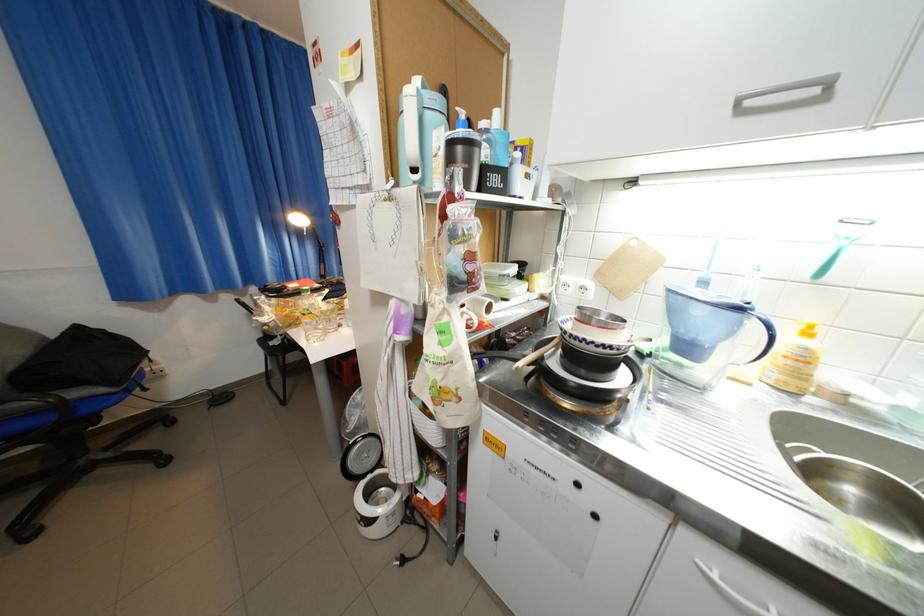
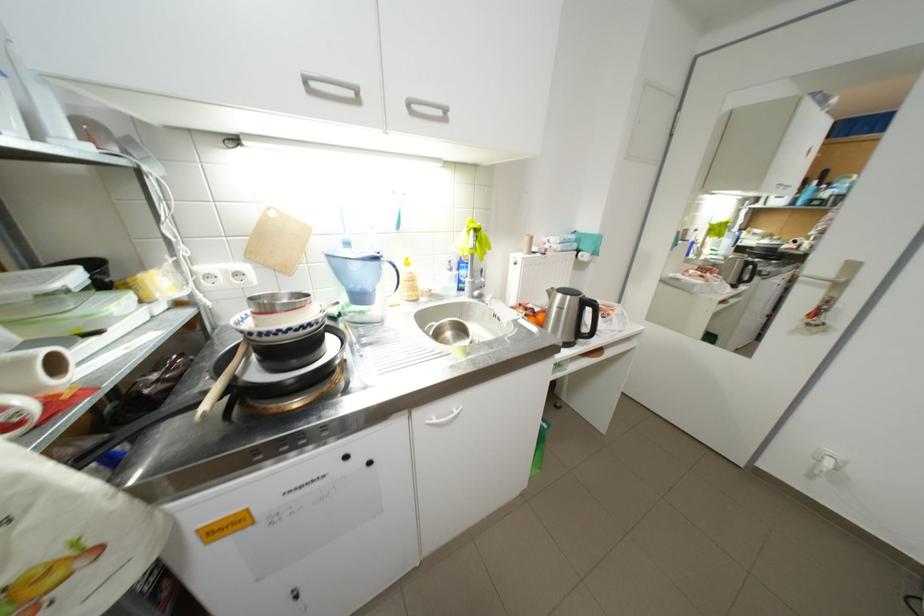
Where in the second image is the point corresponding to (611,277) from the first image?

(262, 256)